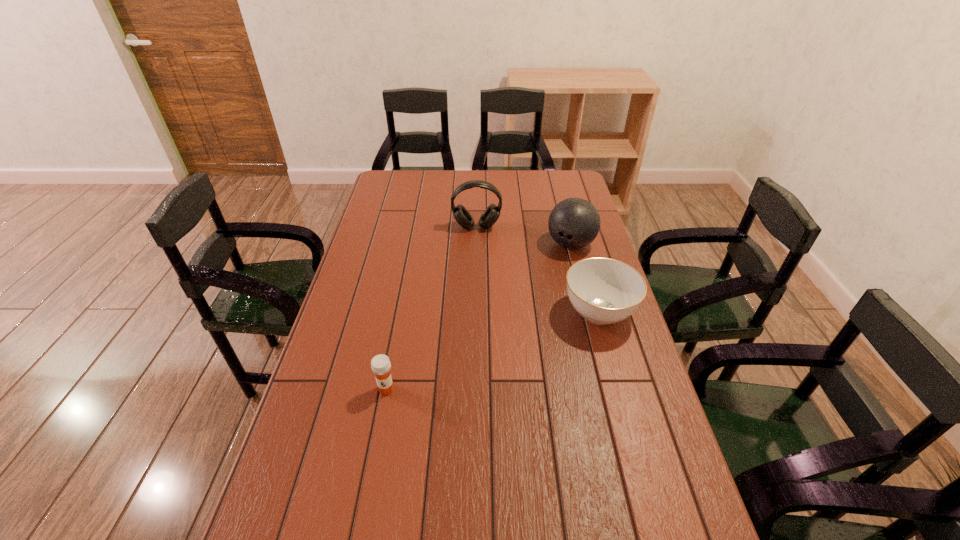
You are a GUI agent. You are given a task and a screenshot of the screen. Output one action in this format:
    pyautogui.click(x=<x>, y=<y>)
    Task: Click on the vacant space located on the grip area of the bowling ball
    The image size is (960, 540).
    Given the screenshot: What is the action you would take?
    point(540,292)

You are a GUI agent. You are given a task and a screenshot of the screen. Output one action in this format:
    pyautogui.click(x=<x>, y=<y>)
    Task: Click on the vacant space situated 0.400m on the grip area of the bowling ball
    The image size is (960, 540).
    Given the screenshot: What is the action you would take?
    pyautogui.click(x=516, y=329)

What are the coordinates of `vacant space located 0.130m on the grip area of the bowling ball` in the screenshot? It's located at (548, 278).

This screenshot has width=960, height=540. In order to click on chinaware located in the right edge section of the desktop in this screenshot , I will do `click(604, 291)`.

This screenshot has height=540, width=960. I want to click on bowling ball present at the right edge, so click(x=574, y=223).

This screenshot has width=960, height=540. What are the coordinates of `vacant space at the far edge of the desktop` in the screenshot? It's located at (510, 186).

The width and height of the screenshot is (960, 540). In the image, there is a desktop. Identify the location of free space at the near edge. (379, 525).

In the image, there is a desktop. Where is `vacant space at the left edge`? vacant space at the left edge is located at coordinates (347, 292).

Locate an element on the screen. The width and height of the screenshot is (960, 540). vacant point at the right edge is located at coordinates (666, 432).

At what (x,y) coordinates should I click in order to perform the action: click on free space at the far left corner of the desktop. Please return your answer as a coordinate pair (x, y). The width and height of the screenshot is (960, 540). Looking at the image, I should click on (399, 194).